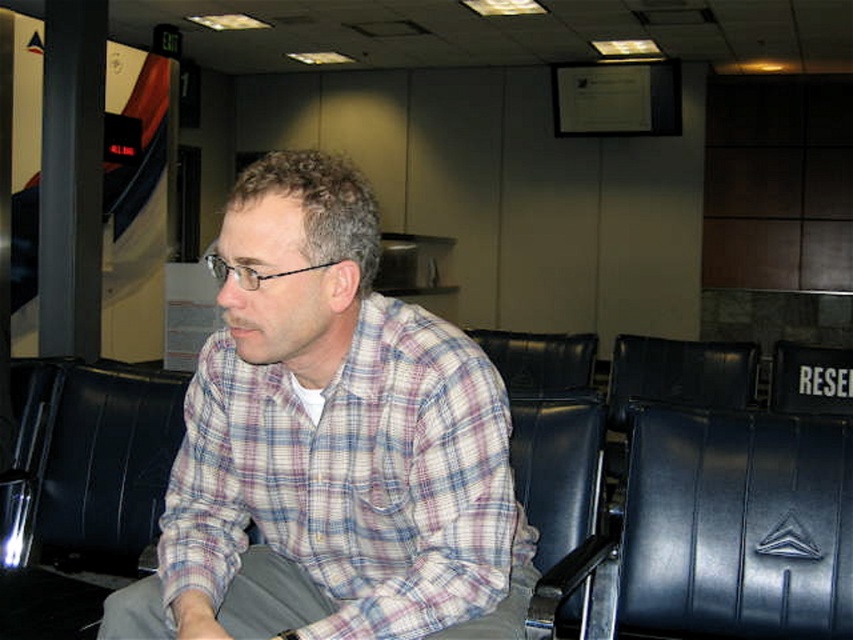
Between black leather swivel chair at center and black leather armchair at left, which one appears on the left side from the viewer's perspective?

black leather armchair at left is more to the left.

Is point (850, 636) less distant than point (103, 496)?

Yes.

Is point (660, 561) positioned after point (51, 380)?

No, (660, 561) is closer to viewer.

Image resolution: width=853 pixels, height=640 pixels. Find the location of `black leather swivel chair at center`. black leather swivel chair at center is located at coordinates (735, 525).

Is plaid cotton shirt at center shorter than black leather armchair at left?

Incorrect, plaid cotton shirt at center's height does not fall short of black leather armchair at left's.

In the scene shown: Is plaid cotton shirt at center further to camera compared to black leather armchair at left?

No, plaid cotton shirt at center is closer to the viewer.

At what (x,y) coordinates should I click in order to perform the action: click on plaid cotton shirt at center. Please return your answer as a coordinate pair (x, y). Looking at the image, I should click on (329, 445).

Who is positioned more to the left, plaid cotton shirt at center or black leather swivel chair at center?

Positioned to the left is plaid cotton shirt at center.

Does plaid cotton shirt at center appear over black leather swivel chair at center?

Indeed, plaid cotton shirt at center is positioned over black leather swivel chair at center.

Who is more forward, (204, 576) or (753, 445)?

Point (204, 576) is more forward.

The image size is (853, 640). What are the coordinates of `plaid cotton shirt at center` in the screenshot? It's located at (329, 445).